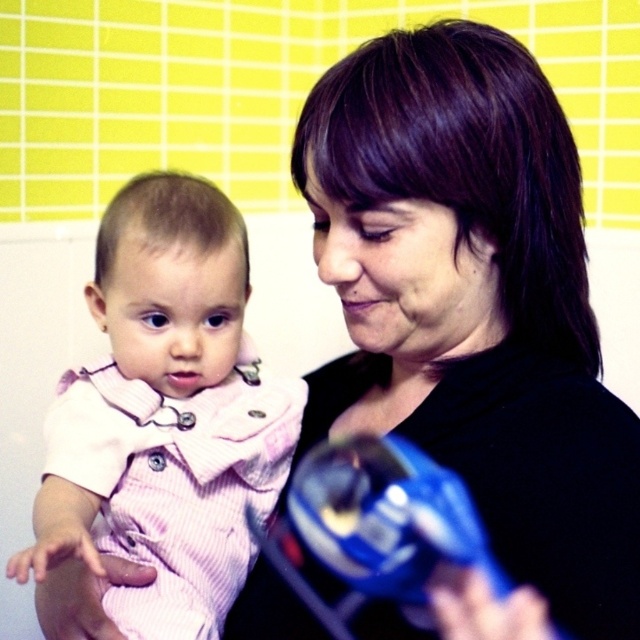
Does black matte hair at center have a greater height compared to pink striped fabric at left?

Indeed, black matte hair at center has a greater height compared to pink striped fabric at left.

Is point (390, 621) closer to camera compared to point (141, 348)?

Yes.

I want to click on black matte hair at center, so click(474, 316).